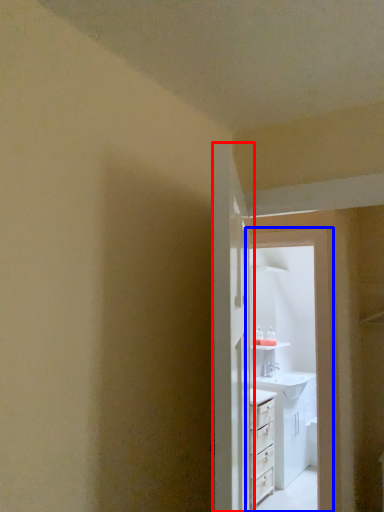
Question: Which point is closer to the camera, door (highlighted by a red box) or screen door (highlighted by a blue box)?

Choices:
 (A) door
 (B) screen door

Answer: (A)